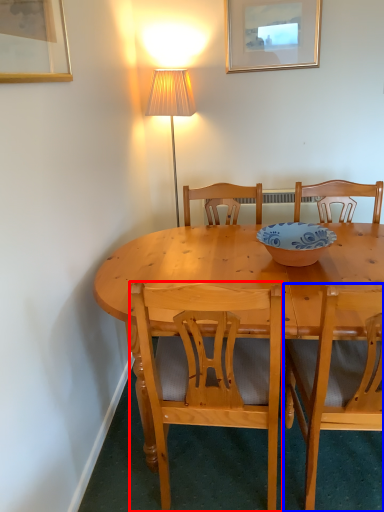
Question: Which object appears farthest to the camera in this image, chair (highlighted by a red box) or chair (highlighted by a blue box)?

Choices:
 (A) chair
 (B) chair

Answer: (A)